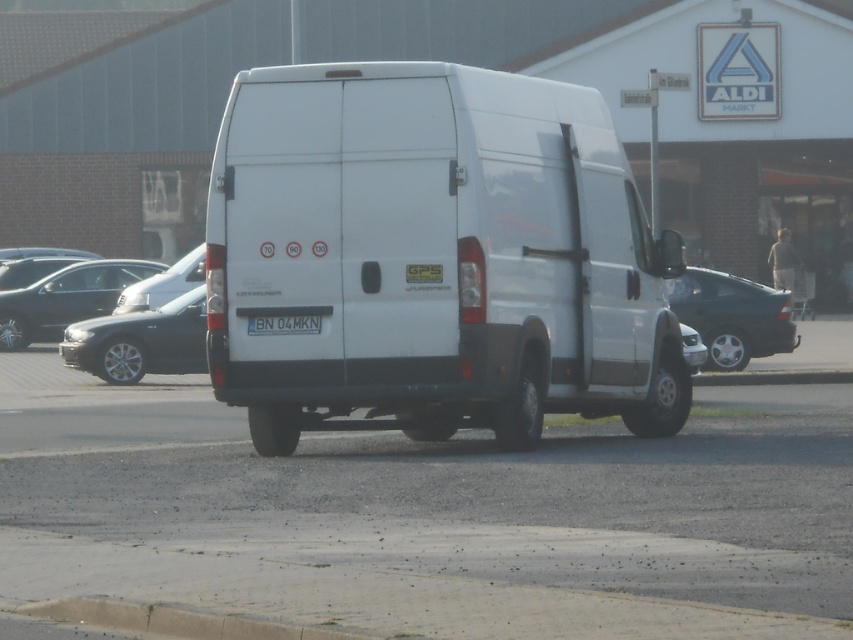
Question: Which point appears farthest from the camera in this image?

Choices:
 (A) (265, 332)
 (B) (552, 192)

Answer: (B)

Question: Which point is closer to the camera?

Choices:
 (A) (268, 74)
 (B) (305, 316)
 (C) (100, 266)

Answer: (B)

Question: Considering the relative positions of shiny black sedan at left and satin silver sedan at center in the image provided, where is shiny black sedan at left located with respect to satin silver sedan at center?

Choices:
 (A) right
 (B) left

Answer: (B)

Question: Is shiny black sedan at center positioned before gray concrete curb at lower center?

Choices:
 (A) yes
 (B) no

Answer: (B)

Question: Which point appears closest to the camera in this image?

Choices:
 (A) (x=291, y=321)
 (B) (x=727, y=371)

Answer: (A)

Question: Is shiny black sedan at left smaller than satin silver sedan at center?

Choices:
 (A) yes
 (B) no

Answer: (A)